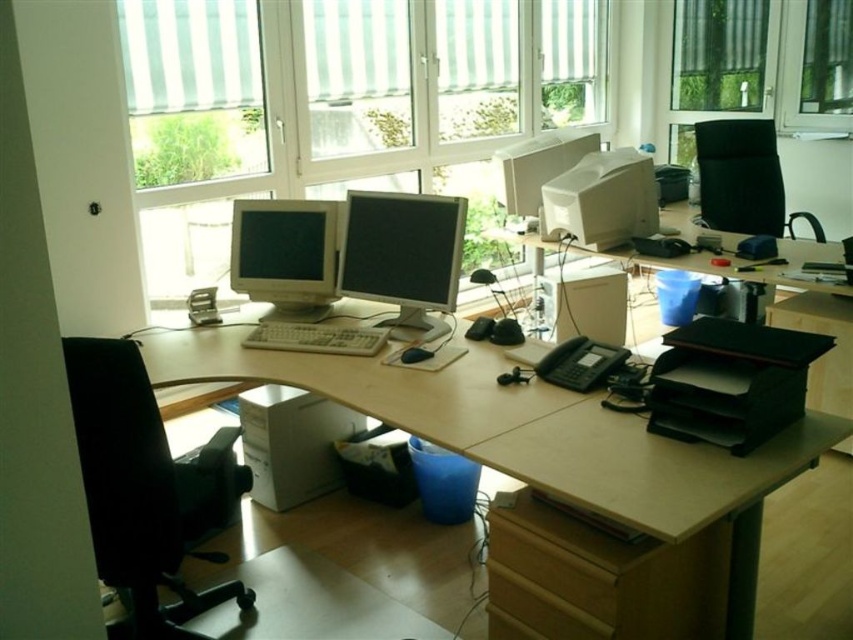
Is point (485, 378) farther from viewer compared to point (607, 154)?

No, it is in front of (607, 154).

How distant is wooden desk at center from white plastic printer at upper center?

1.28 meters

Locate an element on the screen. The height and width of the screenshot is (640, 853). wooden desk at center is located at coordinates (524, 432).

Is point (73, 358) closer to viewer compared to point (424, 358)?

That is True.

Looking at this image, does black plastic swivel chair at left appear on the right side of black matte mouse at center?

No, black plastic swivel chair at left is not to the right of black matte mouse at center.

This screenshot has height=640, width=853. In order to click on black plastic swivel chair at left in this screenshot , I will do `click(138, 488)`.

Can you confirm if black plastic swivel chair at left is positioned to the right of black mesh office chair at upper right?

In fact, black plastic swivel chair at left is to the left of black mesh office chair at upper right.

In the scene shown: Can you confirm if black plastic swivel chair at left is shorter than black mesh office chair at upper right?

No.

What do you see at coordinates (138, 488) in the screenshot?
I see `black plastic swivel chair at left` at bounding box center [138, 488].

Find the location of a particular element. This screenshot has width=853, height=640. black plastic swivel chair at left is located at coordinates (138, 488).